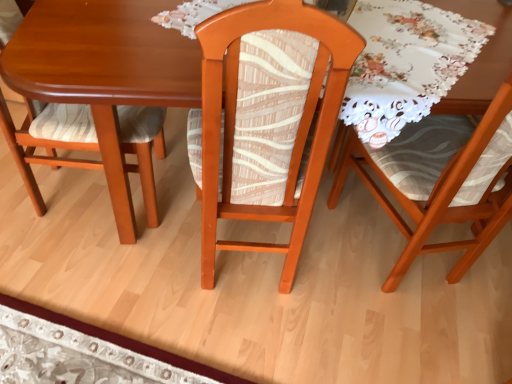
Where is `free space in front of matte wood chair at left, the 1th chair in the left-to-right sequence`? Image resolution: width=512 pixels, height=384 pixels. free space in front of matte wood chair at left, the 1th chair in the left-to-right sequence is located at coordinates [x=86, y=276].